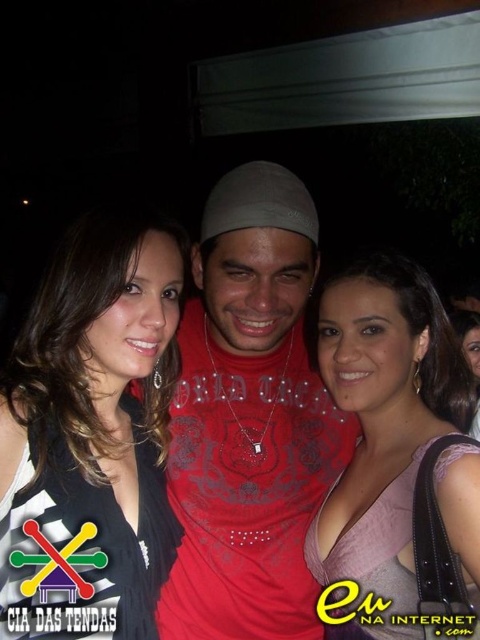
Is matte red t-shirt at center bigger than pink satin dress at center?

Yes, matte red t-shirt at center is bigger than pink satin dress at center.

Measure the distance from matte red t-shirt at center to pink satin dress at center.

matte red t-shirt at center and pink satin dress at center are 18.65 centimeters apart.

Is point (186, 346) closer to camera compared to point (363, 369)?

No, it is not.

This screenshot has width=480, height=640. I want to click on matte red t-shirt at center, so click(x=250, y=419).

Which is in front, point (304, 200) or point (462, 330)?

Point (304, 200)

Does matte red t-shirt at center have a lesser height compared to matte pink dress at center?

Incorrect, matte red t-shirt at center's height does not fall short of matte pink dress at center's.

Where is `matte red t-shirt at center`? The height and width of the screenshot is (640, 480). matte red t-shirt at center is located at coordinates (250, 419).

Who is higher up, black textured dress at center or pink satin dress at center?

black textured dress at center is higher up.

Is point (79, 630) positioned after point (422, 492)?

No, (79, 630) is in front of (422, 492).

Which is behind, point (101, 580) or point (407, 464)?

Point (407, 464)

This screenshot has height=640, width=480. Find the location of `black textured dress at center`. black textured dress at center is located at coordinates (96, 426).